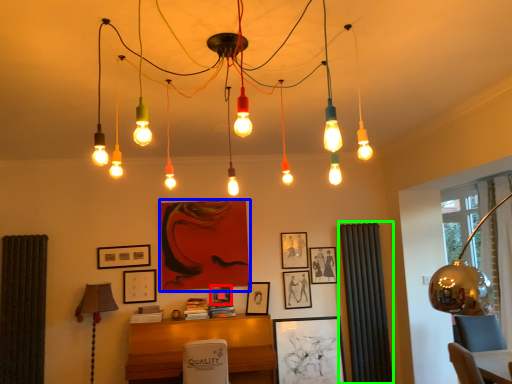
Question: Based on their relative distances, which object is nearer to picture frame (highlighted by a red box)? Choose from picture frame (highlighted by a blue box) and curtain (highlighted by a green box).

Choices:
 (A) picture frame
 (B) curtain

Answer: (A)